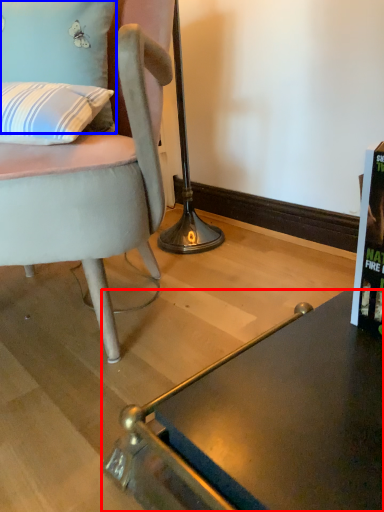
Question: Among these objects, which one is nearest to the camera, desk (highlighted by a red box) or pillow (highlighted by a blue box)?

Choices:
 (A) desk
 (B) pillow

Answer: (A)